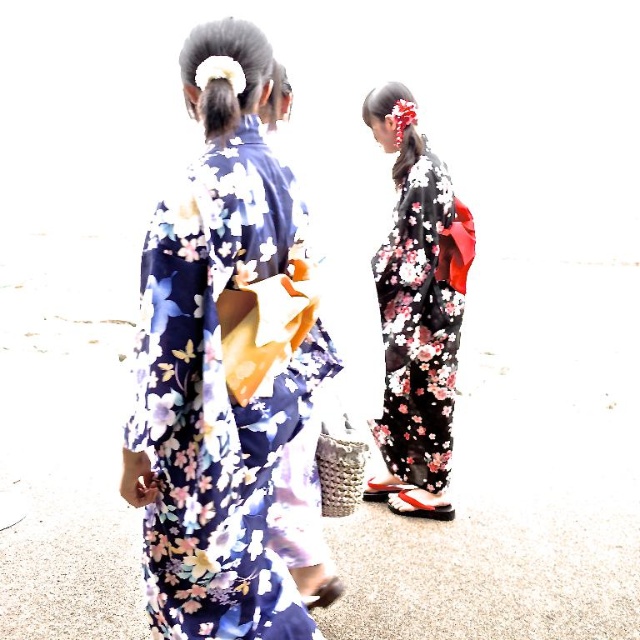
You are a photographer trying to capture both the floral silk kimono at center and the black floral kimono at center in a single shot. Based on their positions, which kimono will appear more in focus if you focus on the one behind?

The black floral kimono at center will appear more in focus because the floral silk kimono at center is positioned over it, meaning the black one is further back and thus would be in focus if focusing on the one behind.

You are a photographer trying to capture a clear shot of both the floral silk kimono at center and the black floral kimono at center. Since you want both subjects to be in focus, which kimono should you adjust your camera focus on first to ensure the foreground is sharp?

The floral silk kimono at center is closer to the viewer than the black floral kimono at center, so you should focus on the floral silk kimono at center first to ensure the foreground is sharp.